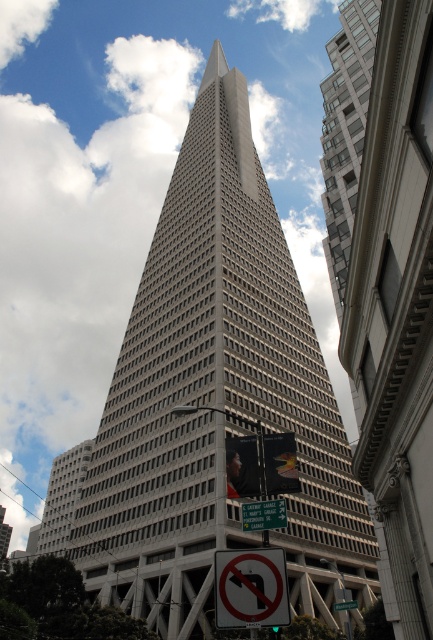
Does point (219, 596) come behind point (268, 512)?

No.

Measure the distance between white plastic sign at lower center and green plastic street sign at center.

white plastic sign at lower center is 3.88 meters from green plastic street sign at center.

This screenshot has width=433, height=640. Find the location of `white plastic sign at lower center`. white plastic sign at lower center is located at coordinates (251, 588).

You are a GUI agent. You are given a task and a screenshot of the screen. Output one action in this format:
    pyautogui.click(x=<x>, y=<y>)
    Task: Click on the white plastic sign at lower center
    This screenshot has height=640, width=433.
    Given the screenshot: What is the action you would take?
    pyautogui.click(x=251, y=588)

Describe the element at coordinates (264, 515) in the screenshot. I see `green plastic street sign at center` at that location.

Does green plastic street sign at center have a larger size compared to white plastic street sign at center?

Incorrect, green plastic street sign at center is not larger than white plastic street sign at center.

Does point (265, 506) come in front of point (349, 605)?

Yes, point (265, 506) is in front of point (349, 605).

You are a GUI agent. You are given a task and a screenshot of the screen. Output one action in this format:
    pyautogui.click(x=<x>, y=<y>)
    Task: Click on the green plastic street sign at center
    
    Given the screenshot: What is the action you would take?
    pyautogui.click(x=264, y=515)

Between point (277, 608) and point (336, 609), which one is positioned behind?

Point (336, 609)

Is white plastic sign at lower center above white plastic street sign at center?

Indeed, white plastic sign at lower center is positioned over white plastic street sign at center.

Is point (238, 616) farther from viewer compared to point (343, 605)?

No, (238, 616) is in front of (343, 605).

Find the location of `white plastic sign at lower center`. white plastic sign at lower center is located at coordinates (251, 588).